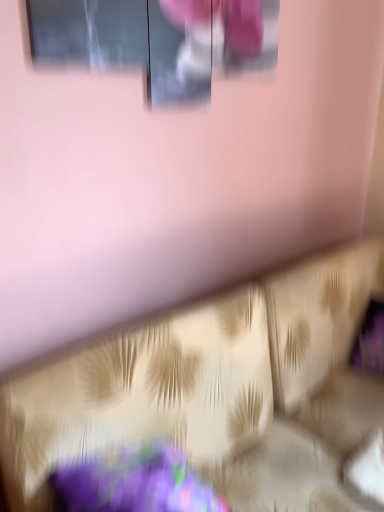
Question: Is matte glass window at upper center at the back of gold textured sofa at lower center?

Choices:
 (A) yes
 (B) no

Answer: (B)

Question: Is gold textured sofa at lower center positioned behind matte glass window at upper center?

Choices:
 (A) yes
 (B) no

Answer: (B)

Question: Does gold textured sofa at lower center have a greater height compared to matte glass window at upper center?

Choices:
 (A) no
 (B) yes

Answer: (B)

Question: Considering the relative sizes of gold textured sofa at lower center and matte glass window at upper center in the image provided, is gold textured sofa at lower center thinner than matte glass window at upper center?

Choices:
 (A) yes
 (B) no

Answer: (B)

Question: Is gold textured sofa at lower center at the left side of matte glass window at upper center?

Choices:
 (A) yes
 (B) no

Answer: (B)

Question: Does gold textured sofa at lower center have a smaller size compared to matte glass window at upper center?

Choices:
 (A) no
 (B) yes

Answer: (A)

Question: Is matte glass window at upper center with gold textured sofa at lower center?

Choices:
 (A) yes
 (B) no

Answer: (B)

Question: Does matte glass window at upper center have a greater height compared to gold textured sofa at lower center?

Choices:
 (A) yes
 (B) no

Answer: (B)

Question: Is matte glass window at upper center at the right side of gold textured sofa at lower center?

Choices:
 (A) yes
 (B) no

Answer: (B)

Question: Is matte glass window at upper center surrounding gold textured sofa at lower center?

Choices:
 (A) no
 (B) yes

Answer: (A)

Question: Are matte glass window at upper center and gold textured sofa at lower center far apart?

Choices:
 (A) no
 (B) yes

Answer: (A)

Question: Is matte glass window at upper center wider than gold textured sofa at lower center?

Choices:
 (A) yes
 (B) no

Answer: (B)

Question: From the image's perspective, relative to matte glass window at upper center, is gold textured sofa at lower center above or below?

Choices:
 (A) above
 (B) below

Answer: (B)